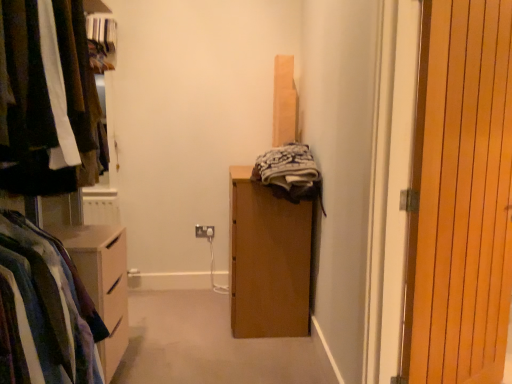
Question: In the image, is matte black clothes at left positioned in front of or behind wooden at right?

Choices:
 (A) behind
 (B) front

Answer: (B)

Question: Is matte black clothes at left inside the boundaries of wooden at right, or outside?

Choices:
 (A) outside
 (B) inside

Answer: (A)

Question: Which object is the closest to the wooden at right?

Choices:
 (A) matte black clothes at left
 (B) striped cotton shirt at left
 (C) white plastic electric outlet at center

Answer: (B)

Question: Which of these objects is positioned closest to the matte black clothes at left?

Choices:
 (A) striped cotton shirt at left
 (B) wooden at right
 (C) white plastic electric outlet at center

Answer: (A)